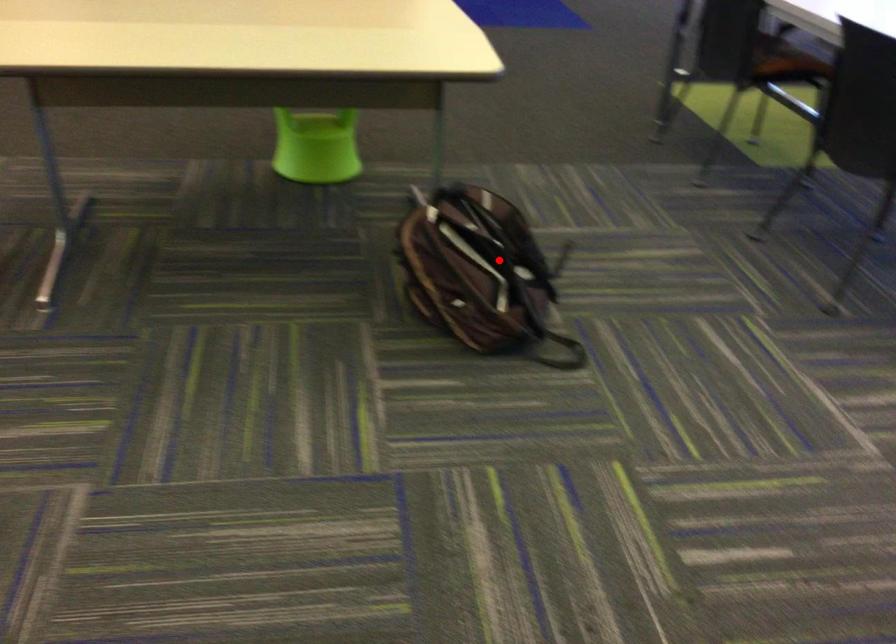
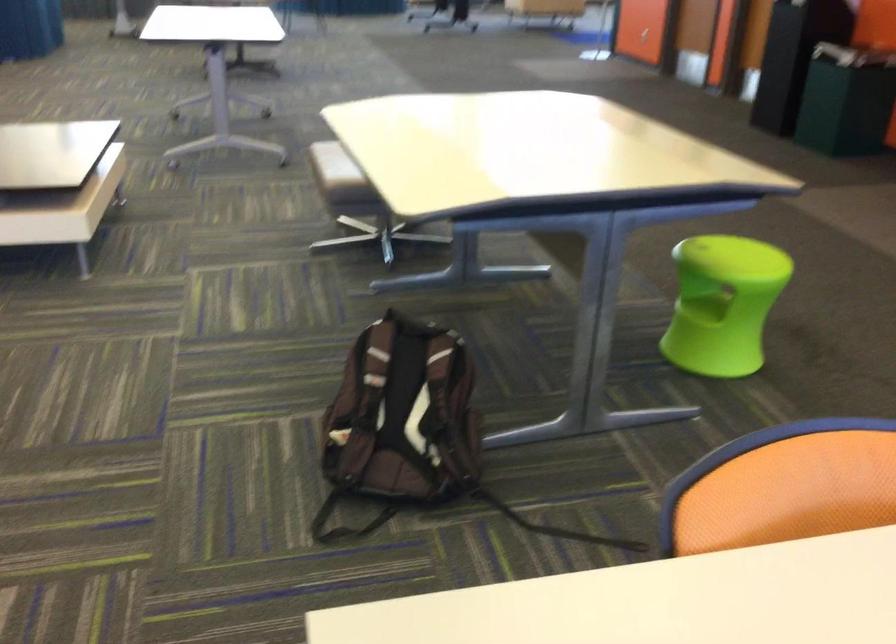
Find the pixel in the second image that matches the highlighted location in the first image.

(402, 413)